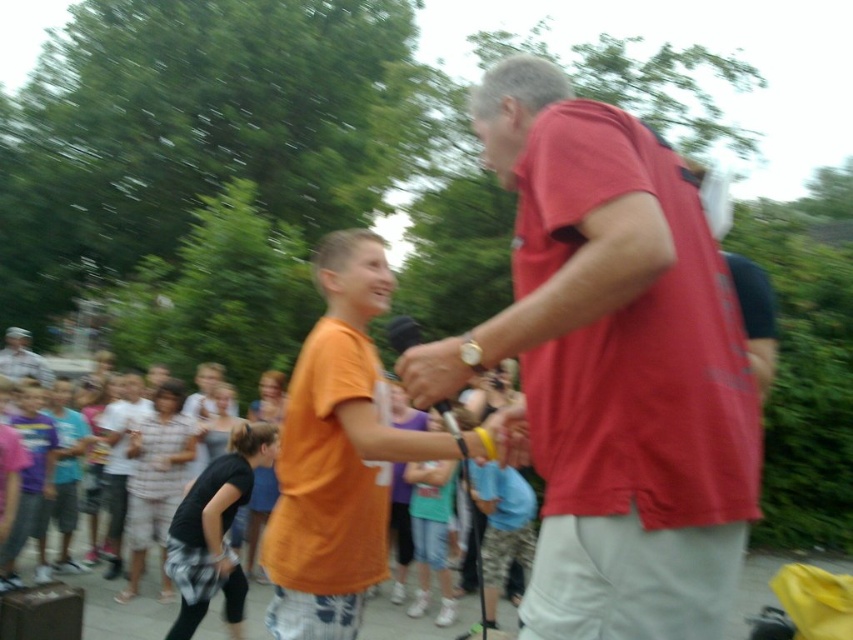
Question: Can you confirm if orange cotton shirt at center is smaller than black cotton shirt at center?

Choices:
 (A) yes
 (B) no

Answer: (A)

Question: Considering the real-world distances, which object is farthest from the camouflage uniform at lower left?

Choices:
 (A) orange cotton shirt at center
 (B) black cotton shirt at center
 (C) matte red shirt at center
 (D) plaid shirt at center

Answer: (C)

Question: Can you confirm if black cotton shirt at center is thinner than plaid shirt at center?

Choices:
 (A) no
 (B) yes

Answer: (B)

Question: Is matte red shirt at center to the left of orange cotton shirt at center from the viewer's perspective?

Choices:
 (A) yes
 (B) no

Answer: (B)

Question: Which point is closer to the camera?

Choices:
 (A) (213, 556)
 (B) (496, 68)
 (C) (341, 259)
 (D) (22, 362)

Answer: (B)

Question: Among these objects, which one is farthest from the camera?

Choices:
 (A) orange cotton shirt at center
 (B) black cotton shirt at center
 (C) plaid shirt at center
 (D) camouflage uniform at lower left

Answer: (D)